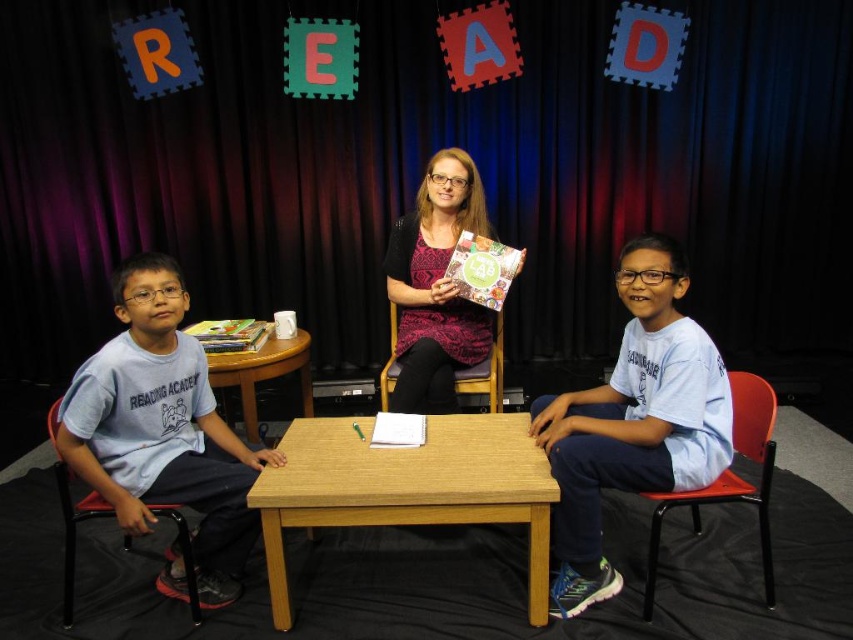
Question: Is light blue t-shirt at left above black plastic chair at left?

Choices:
 (A) no
 (B) yes

Answer: (B)

Question: Is light brown wood table at center below black plastic chair at lower right?

Choices:
 (A) yes
 (B) no

Answer: (A)

Question: Which point is closer to the camera?

Choices:
 (A) (613, 570)
 (B) (381, 408)
 (C) (540, 525)

Answer: (C)

Question: Considering the real-world distances, which object is farthest from the matte black sweater at center?

Choices:
 (A) black plastic chair at lower right
 (B) light brown wood table at center
 (C) black curtain at upper center
 (D) light blue t-shirt at left

Answer: (C)

Question: Does black curtain at upper center appear on the right side of light blue t-shirt at center?

Choices:
 (A) yes
 (B) no

Answer: (B)

Question: Which point appears farthest from the camera in this image?

Choices:
 (A) (270, 589)
 (B) (648, 323)

Answer: (B)